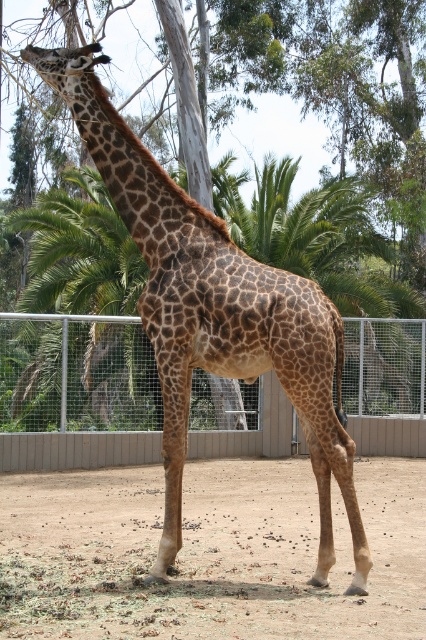
You are a zookeeper who wants to ensure the giraffe can comfortably reach its food. The giraffe is at the center of the enclosure. Considering the metal wire fence at center, can the brown spotted giraffe at center reach over the fence to eat leaves from a tree outside the enclosure?

The brown spotted giraffe at center is taller than the metal wire fence at center, so it can easily reach over the fence to eat leaves from a tree outside the enclosure.